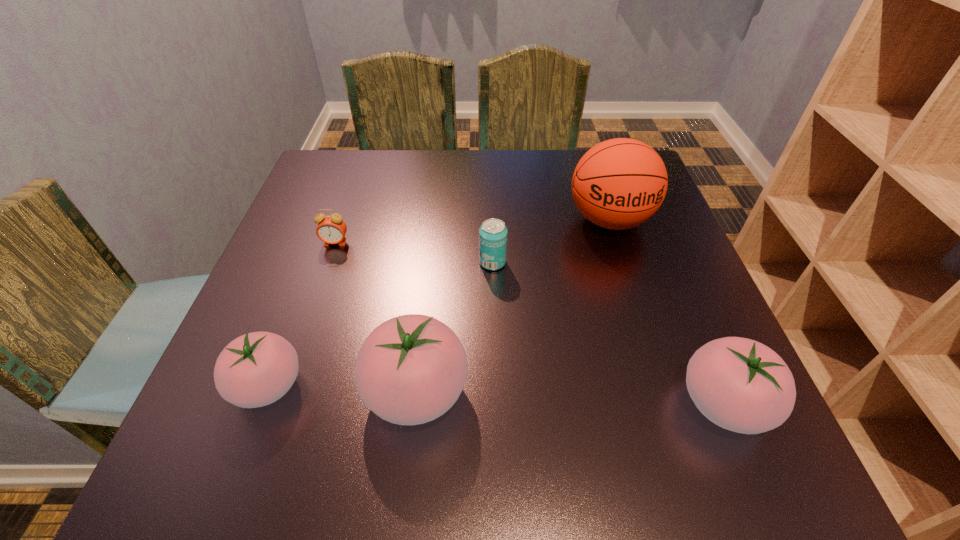
This screenshot has width=960, height=540. What are the coordinates of `vacant area that lies between the basketball and the alarm clock` in the screenshot? It's located at (472, 232).

Where is `free space that is in between the shortest tomato and the tallest object`? The image size is (960, 540). free space that is in between the shortest tomato and the tallest object is located at coordinates (439, 303).

Find the location of a particular element. The height and width of the screenshot is (540, 960). free space between the beer can and the basketball is located at coordinates (551, 241).

Identify the location of free space between the alarm clock and the basketball. (472, 232).

Find the location of `unoccupied area between the second shortest tomato and the third farthest object`. unoccupied area between the second shortest tomato and the third farthest object is located at coordinates (608, 333).

At what (x,y) coordinates should I click in order to perform the action: click on unoccupied area between the fourth object from left to right and the rightmost tomato. Please return your answer as a coordinate pair (x, y). This screenshot has width=960, height=540. Looking at the image, I should click on (608, 333).

What are the coordinates of `vacant area between the tallest object and the beer can` in the screenshot? It's located at (551, 241).

Identify the location of empty space between the fourth object from left to right and the tallest object. (551, 241).

Select which object is the fifth closest to the fourth object from right to left. Please provide its 2D coordinates. Your answer should be formatted as a tuple, i.e. [(x, y)], where the tuple contains the x and y coordinates of a point satisfying the conditions above.

[(618, 184)]

I want to click on the fifth closest object to the tallest object, so click(256, 369).